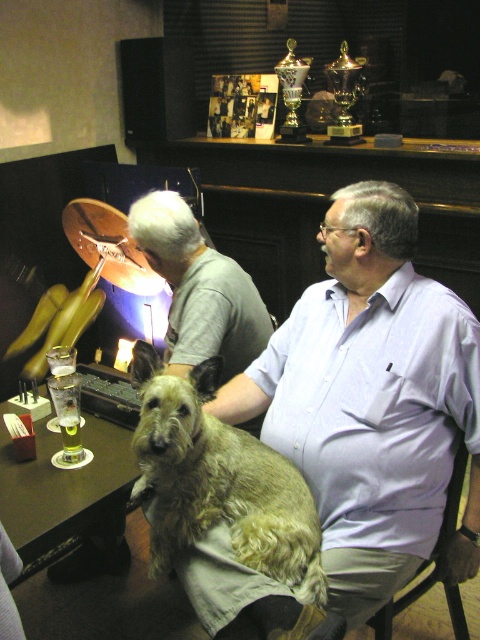
Question: Which object appears farthest from the camera in this image?

Choices:
 (A) green glass at lower left
 (B) fuzzy brown dog at center
 (C) gray cotton shirt at center

Answer: (C)

Question: Does fuzzy brown dog at center appear over green glass at lower left?

Choices:
 (A) no
 (B) yes

Answer: (B)

Question: Can you confirm if green glass at lower left is bigger than translucent glass beer at table left?

Choices:
 (A) no
 (B) yes

Answer: (B)

Question: Which object is farther from the camera taking this photo?

Choices:
 (A) translucent glass beer at table left
 (B) fuzzy brown dog at center

Answer: (A)

Question: Which object is the farthest from the fuzzy brown dog at center?

Choices:
 (A) translucent glass beer at table left
 (B) gray cotton shirt at center

Answer: (B)

Question: Can you confirm if gray cotton shirt at center is positioned below green glass at lower left?

Choices:
 (A) yes
 (B) no

Answer: (B)